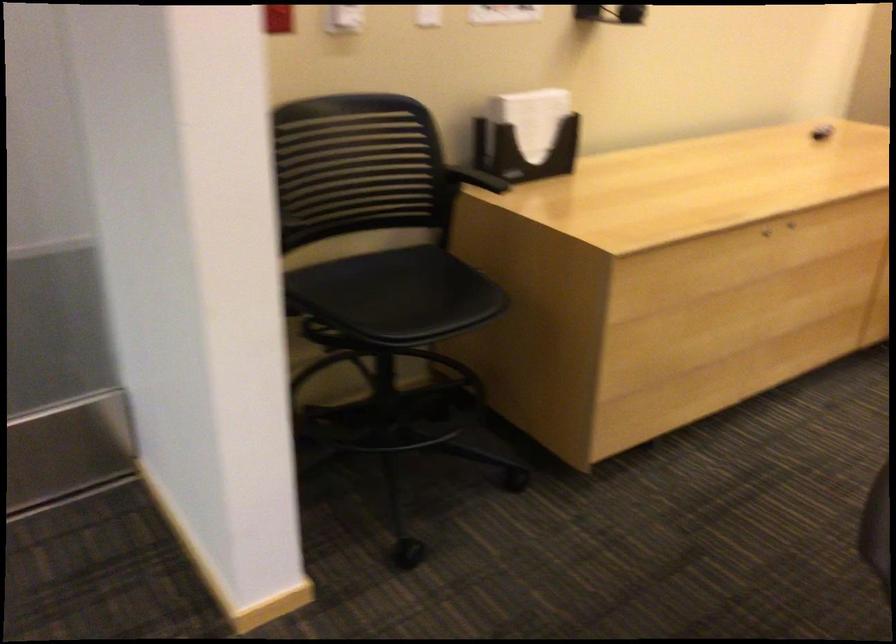
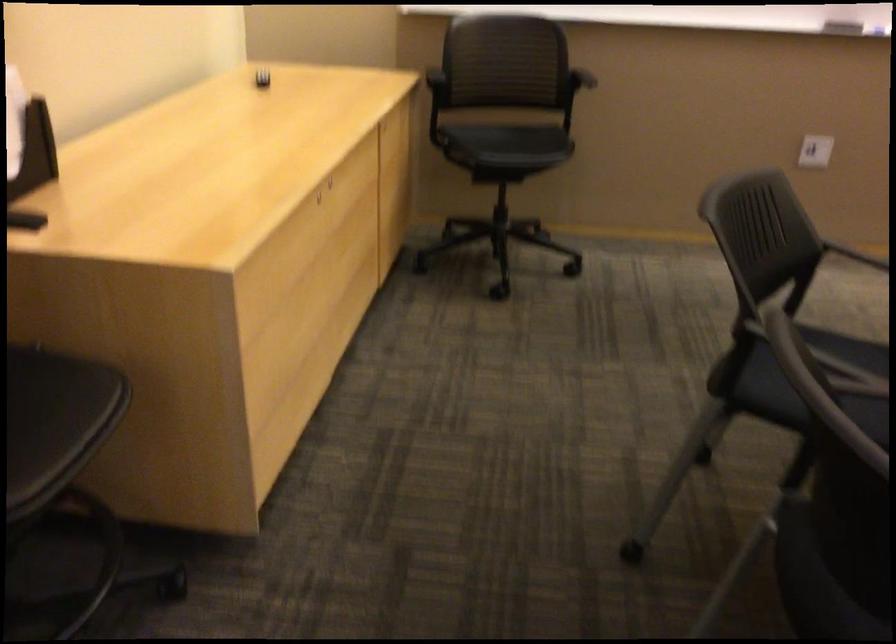
Question: The images are taken continuously from a first-person perspective. In which direction is your viewpoint rotating?

Choices:
 (A) Left
 (B) Right
 (C) Up
 (D) Down

Answer: (B)